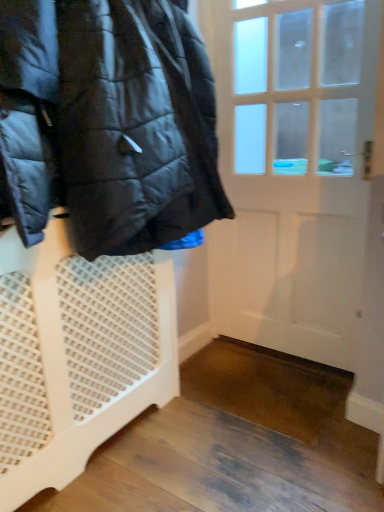
Locate an element on the screen. This screenshot has height=512, width=384. vacant space in white mesh laundry basket at left (from a real-world perspective) is located at coordinates (114, 445).